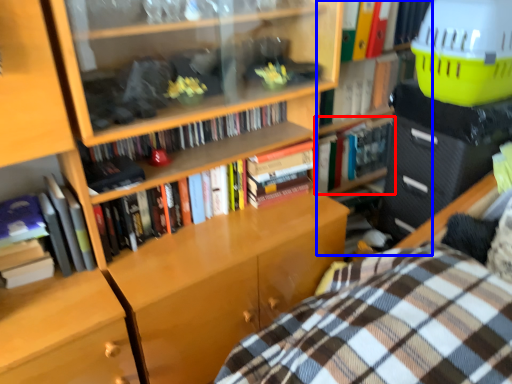
Question: Which object is further to the camera taking this photo, book (highlighted by a red box) or bookshelf (highlighted by a blue box)?

Choices:
 (A) book
 (B) bookshelf

Answer: (A)